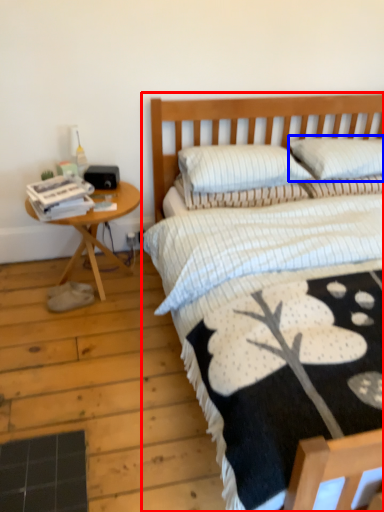
Question: Which object appears farthest to the camera in this image, bed (highlighted by a red box) or pillow (highlighted by a blue box)?

Choices:
 (A) bed
 (B) pillow

Answer: (B)